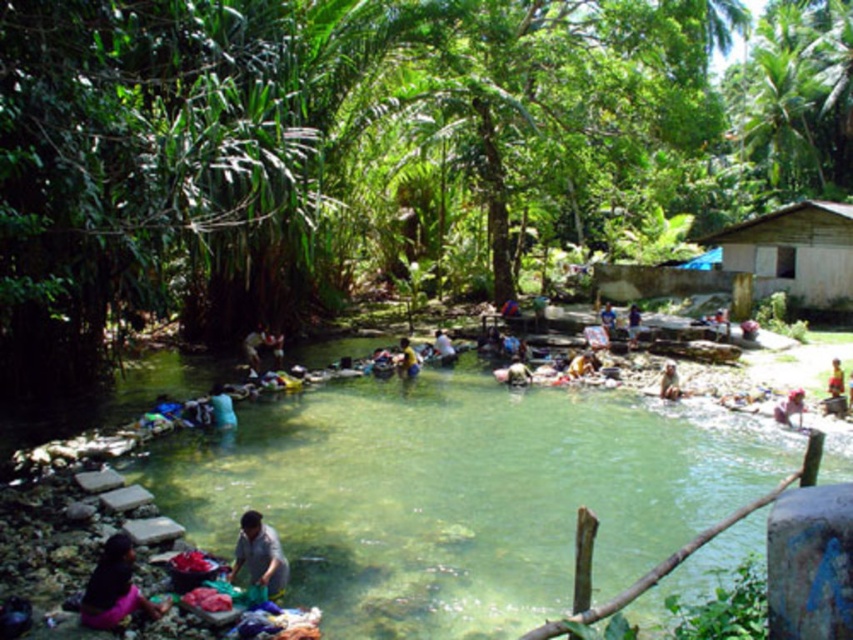
Question: Which object appears farthest from the camera in this image?

Choices:
 (A) clear water stream at center
 (B) light brown fabric at center
 (C) yellow fabric at center

Answer: (B)

Question: Can you confirm if brown wooden hut at right is positioned below dark gray fabric at center?

Choices:
 (A) yes
 (B) no

Answer: (B)

Question: Is smooth brown skin at lower right thinner than blue fabric at center?

Choices:
 (A) yes
 (B) no

Answer: (A)

Question: Which object is positioned farthest from the gray fabric at lower center?

Choices:
 (A) orange fabric at center
 (B) dark gray fabric at center
 (C) light brown fabric at center

Answer: (A)

Question: From the image, what is the correct spatial relationship of gray fabric at lower center in relation to pink fabric at lower right?

Choices:
 (A) right
 (B) left

Answer: (B)

Question: Which point is closer to the camera?

Choices:
 (A) light brown fabric at center
 (B) dark gray fabric at center

Answer: (B)